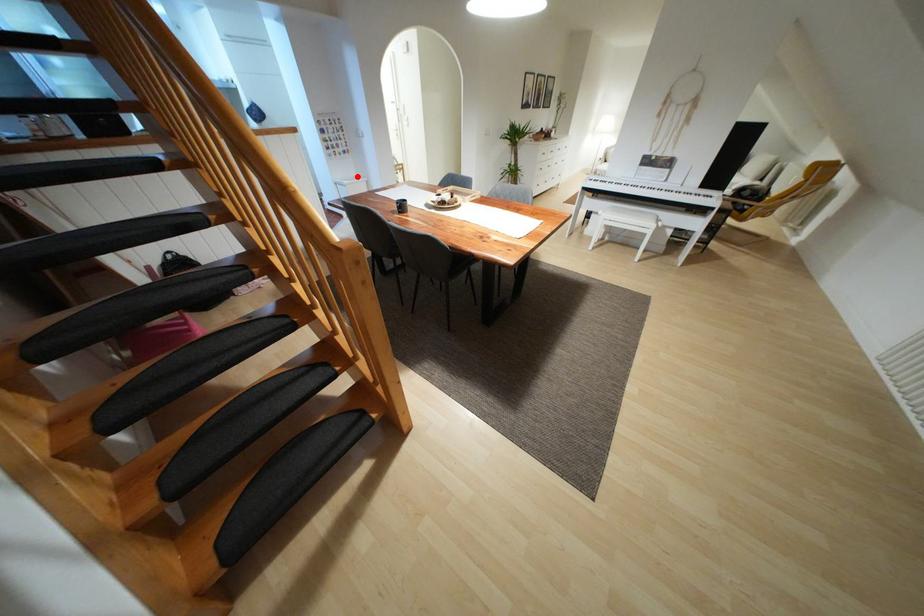
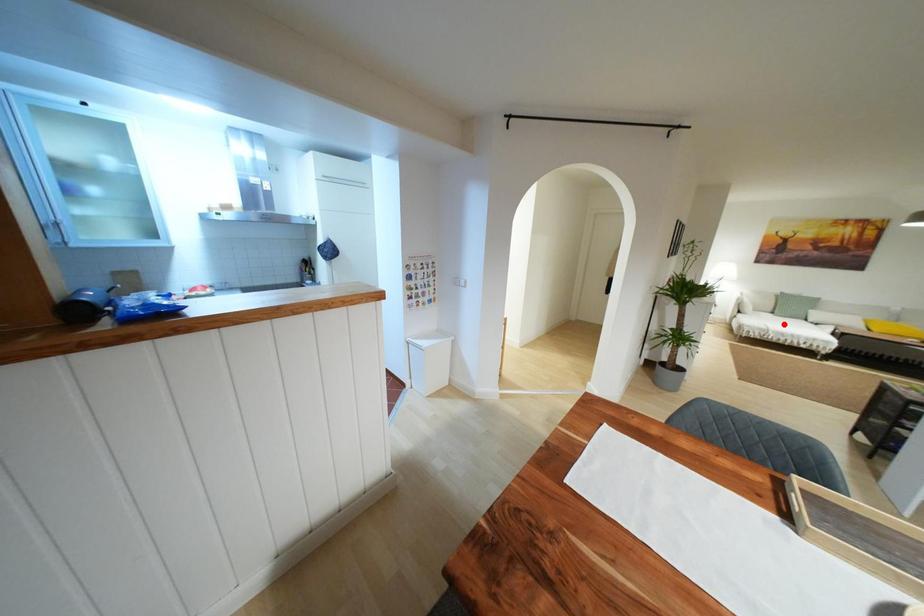
I am providing you with two images of the same scene from different viewpoints. A red point is marked on the first image and another point is marked on the second image. Does the point marked in image1 correspond to the same location as the one in image2?

No